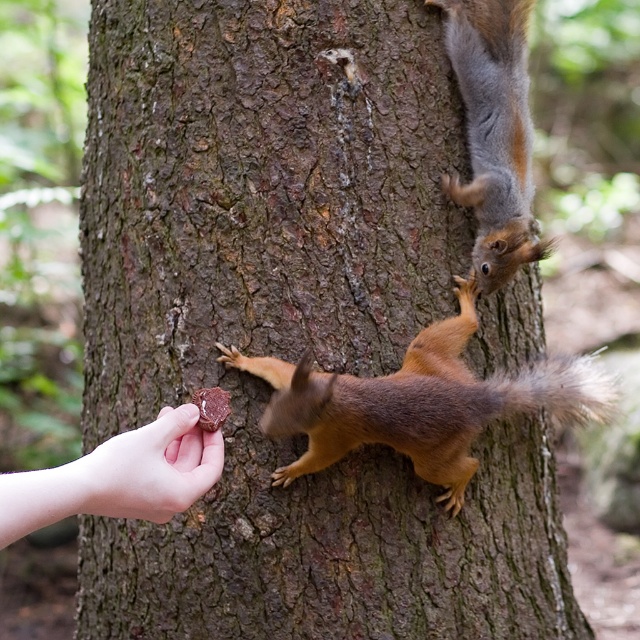
You are a photographer trying to capture the interaction between the shiny brown fur at upper right and the smooth skin hand at lower left. Which object should you focus on first if you want to ensure both are in sharp focus?

The shiny brown fur at upper right should be focused on first because it is above the smooth skin hand at lower left, so focusing on the upper object ensures both are in sharp focus.

You are a squirrel trying to reach the food being offered by the human hand. You are currently at point (540, 364). Which direction should you move to get to the food at point (504, 10)?

The point (504, 10) is in front of point (540, 364). So, you should move forward towards the point (504, 10) to reach the food.

You are standing in the forest scene and want to place a small treat exactly where the brown furry squirrel at lower center is currently located. According to the coordinates provided, what are the 2D coordinates where you should place the treat?

The 2D coordinates for the brown furry squirrel at lower center are at point (x=419, y=403), so you should place the treat at those coordinates.